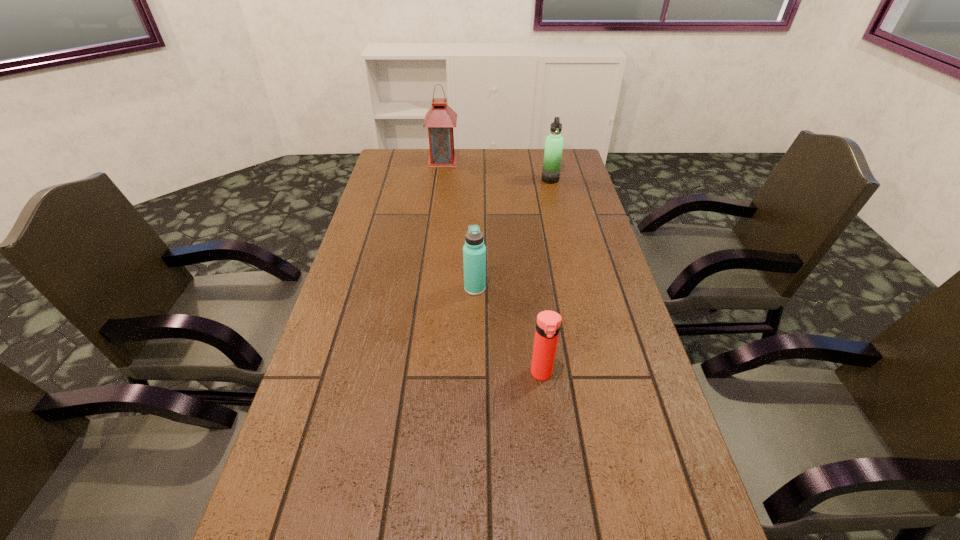
Where is `the leftmost object`? the leftmost object is located at coordinates (440, 119).

The image size is (960, 540). What are the coordinates of `the tallest object` in the screenshot? It's located at (440, 119).

I want to click on the third shortest object, so click(x=554, y=142).

Identify the location of the rightmost thermos bottle. This screenshot has height=540, width=960. (554, 142).

At what (x,y) coordinates should I click in order to perform the action: click on the second farthest thermos bottle. Please return your answer as a coordinate pair (x, y). Looking at the image, I should click on (474, 251).

What are the coordinates of `the leftmost thermos bottle` in the screenshot? It's located at (474, 251).

Identify the location of the second object from right to left. (548, 323).

Identify the location of the second thermos bottle from right to left. The width and height of the screenshot is (960, 540). (548, 323).

Locate an element on the screen. vacant space located 0.230m on the front of the leftmost object is located at coordinates (438, 200).

You are a GUI agent. You are given a task and a screenshot of the screen. Output one action in this format:
    pyautogui.click(x=<x>, y=<y>)
    Task: Click on the free space located on the front of the rightmost thermos bottle
    The height and width of the screenshot is (540, 960).
    Given the screenshot: What is the action you would take?
    pyautogui.click(x=563, y=233)